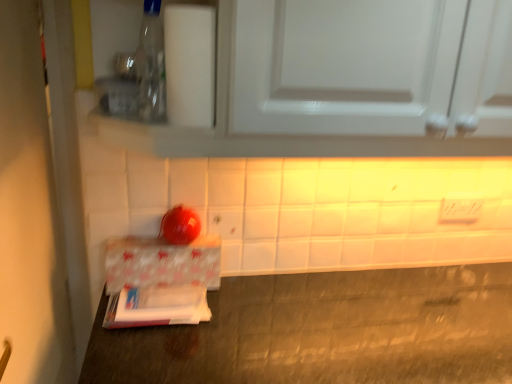
Question: Can you confirm if white glossy cabinet at upper center is bigger than transparent plastic bottle at upper left?

Choices:
 (A) yes
 (B) no

Answer: (A)

Question: Does white glossy cabinet at upper center have a lesser width compared to transparent plastic bottle at upper left?

Choices:
 (A) yes
 (B) no

Answer: (B)

Question: Can you confirm if white glossy cabinet at upper center is shorter than transparent plastic bottle at upper left?

Choices:
 (A) yes
 (B) no

Answer: (B)

Question: Is white glossy cabinet at upper center completely or partially outside of transparent plastic bottle at upper left?

Choices:
 (A) yes
 (B) no

Answer: (A)

Question: From a real-world perspective, is white glossy cabinet at upper center on transparent plastic bottle at upper left?

Choices:
 (A) yes
 (B) no

Answer: (B)

Question: Is white glossy cabinet at upper center to the right of transparent plastic bottle at upper left from the viewer's perspective?

Choices:
 (A) yes
 (B) no

Answer: (A)

Question: Is white glossy cabinet at upper center next to patterned paperboard at lower left?

Choices:
 (A) no
 (B) yes

Answer: (A)

Question: From the image's perspective, is white glossy cabinet at upper center beneath patterned paperboard at lower left?

Choices:
 (A) no
 (B) yes

Answer: (A)

Question: Is white glossy cabinet at upper center not within patterned paperboard at lower left?

Choices:
 (A) yes
 (B) no

Answer: (A)

Question: Can patterned paperboard at lower left be found inside white glossy cabinet at upper center?

Choices:
 (A) yes
 (B) no

Answer: (B)

Question: Is white glossy cabinet at upper center looking in the opposite direction of patterned paperboard at lower left?

Choices:
 (A) yes
 (B) no

Answer: (B)

Question: Considering the relative positions of white glossy cabinet at upper center and patterned paperboard at lower left in the image provided, is white glossy cabinet at upper center in front of patterned paperboard at lower left?

Choices:
 (A) yes
 (B) no

Answer: (A)

Question: From the image's perspective, would you say white glossy door at left is positioned over patterned paperboard at lower left?

Choices:
 (A) yes
 (B) no

Answer: (B)